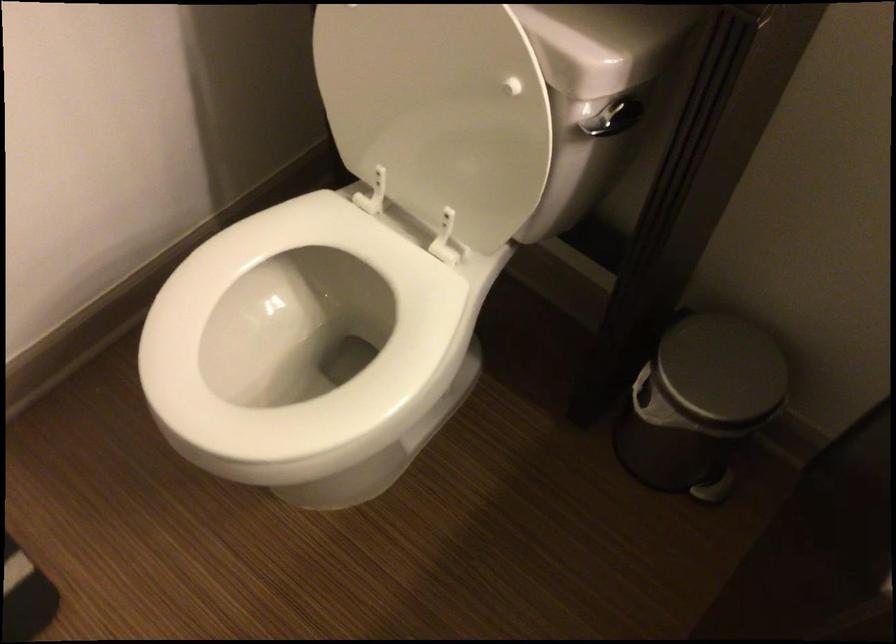
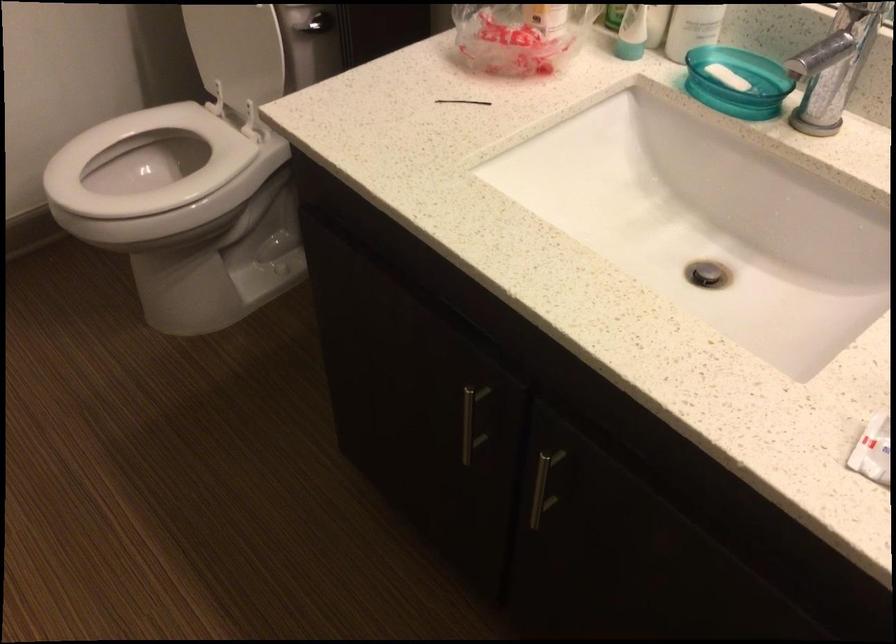
Locate, in the second image, the point that corresponds to (257,281) in the first image.

(144, 163)